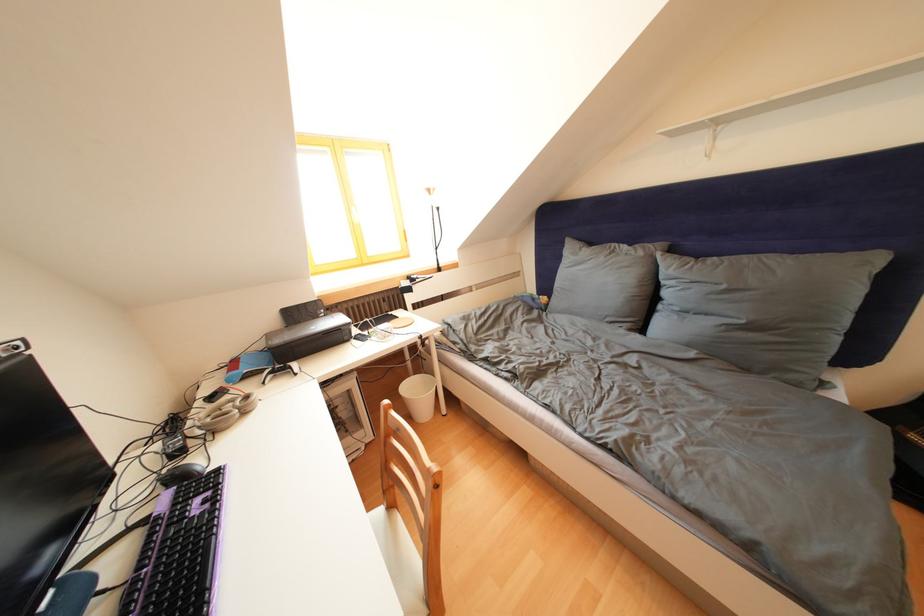
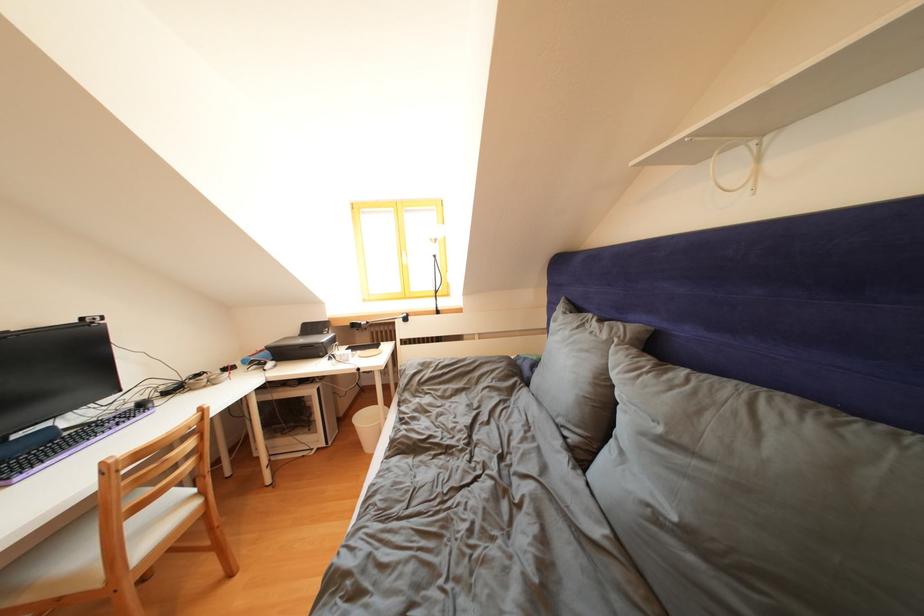
Where in the second image is the point corresponding to [733,292] from the first image?

(667, 435)